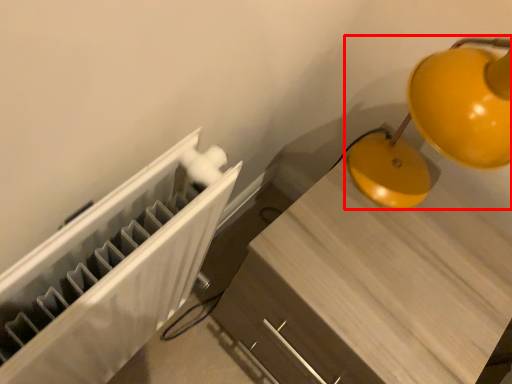
Question: From the image's perspective, what is the correct spatial relationship of lamp (annotated by the red box) in relation to furniture?

Choices:
 (A) above
 (B) below

Answer: (A)